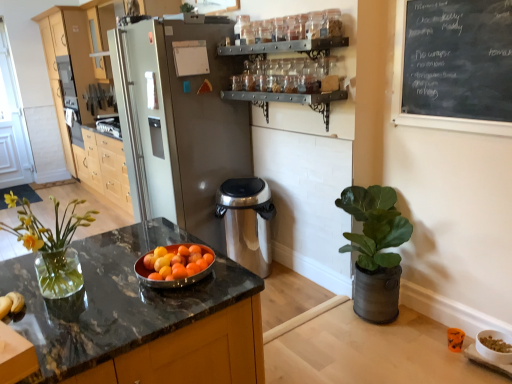
Locate an element on the screen. free space behind clear glass vase at left is located at coordinates (115, 247).